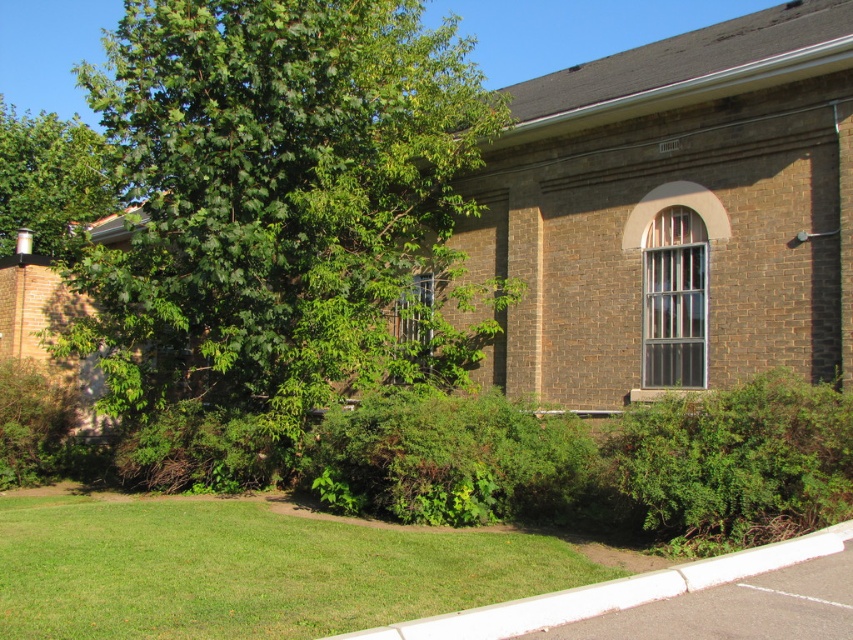
You are standing on the pavement in front of the building. You want to walk towards the green leafy tree at upper left but there is a green leafy bush at lower right blocking your path. Can you go around it? Explain your reasoning.

The green leafy bush at lower right is in front of the green leafy tree at upper left, meaning the bush is closer to you. Since the bush is blocking your path, you can go around it by moving either to the left or right side of the bush to reach the tree.

You are a gardener planning to plant a new tree in the lawn area. Considering the position of the white concrete curb at lower center and the green leafy tree at upper left, where would you place the new tree to ensure it has enough space to grow without obstructing the curb?

The white concrete curb at lower center is located below the green leafy tree at upper left, so placing the new tree away from the curb and closer to the existing tree would provide adequate space for growth while avoiding obstruction.

You are standing on the pavement in front of the brick building and want to place a small potted plant exactly at the location marked by the white concrete curb at lower center. What are the coordinates where you should place it?

The coordinates for the white concrete curb at lower center are [610,593].